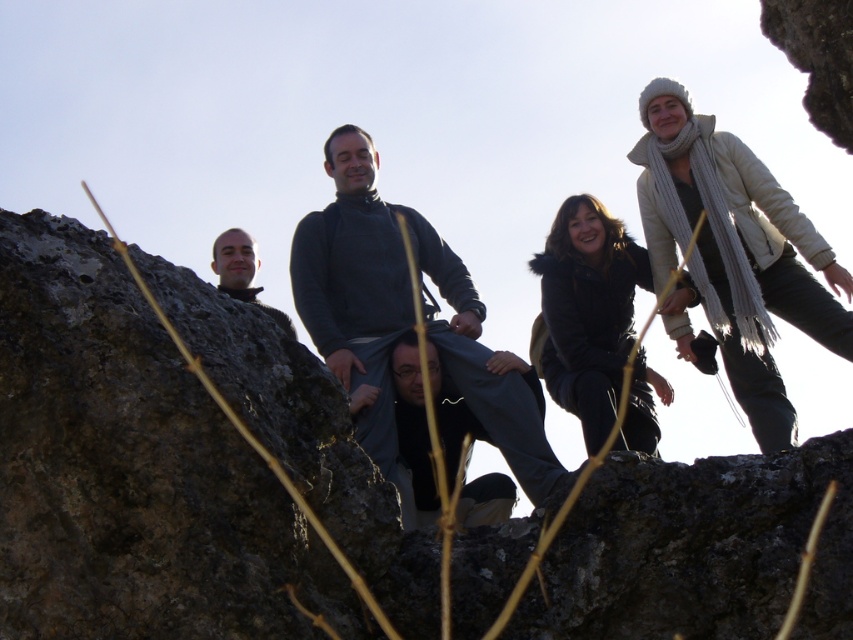
How distant is dark gray sweater at center from matte gray sweater at center?

dark gray sweater at center and matte gray sweater at center are 37.80 feet apart.

Between point (418, 269) and point (229, 228), which one is positioned in front?

Positioned in front is point (418, 269).

The width and height of the screenshot is (853, 640). What are the coordinates of `dark gray sweater at center` in the screenshot? It's located at (x=401, y=316).

Can you confirm if dark gray sweater at center is positioned to the right of black fuzzy coat at center?

No, dark gray sweater at center is not to the right of black fuzzy coat at center.

Does dark gray sweater at center have a greater width compared to black fuzzy coat at center?

Yes.

Image resolution: width=853 pixels, height=640 pixels. Identify the location of dark gray sweater at center. (401, 316).

Does point (532, 384) come behind point (248, 266)?

No, it is not.

At what (x,y) coordinates should I click in order to perform the action: click on dark gray fabric at center. Please return your answer as a coordinate pair (x, y). Looking at the image, I should click on (412, 436).

Who is more forward, (x=440, y=397) or (x=267, y=310)?

Point (x=440, y=397) is in front.

Locate an element on the screen. This screenshot has height=640, width=853. dark gray fabric at center is located at coordinates (412, 436).